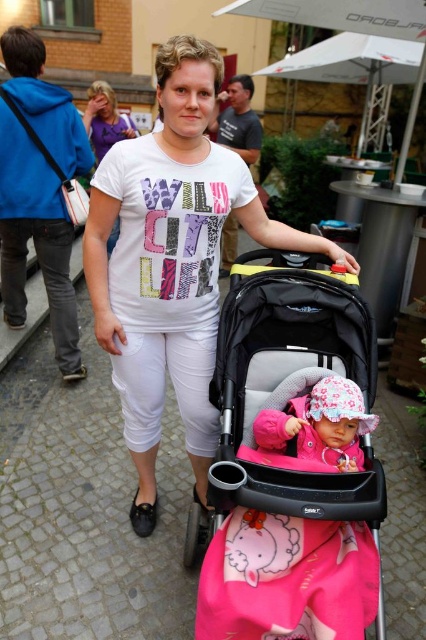
Does point (129, 624) lie in front of point (195, 259)?

Yes, point (129, 624) is closer to viewer.

Who is shorter, cobblestone pavement at center or white printed t-shirt at center?

white printed t-shirt at center

Where is `cobblestone pavement at center`? The image size is (426, 640). cobblestone pavement at center is located at coordinates (81, 529).

Between brushed metal bag at left and dark gray t-shirt at upper center, which one appears on the right side from the viewer's perspective?

dark gray t-shirt at upper center is more to the right.

In the scene shown: Who is lower down, brushed metal bag at left or dark gray t-shirt at upper center?

brushed metal bag at left is below.

Where is `brushed metal bag at left`? The height and width of the screenshot is (640, 426). brushed metal bag at left is located at coordinates (36, 240).

The height and width of the screenshot is (640, 426). What are the coordinates of `brushed metal bag at left` in the screenshot? It's located at (36, 240).

The width and height of the screenshot is (426, 640). What do you see at coordinates (290, 465) in the screenshot? I see `black plastic baby carriage at center` at bounding box center [290, 465].

I want to click on black plastic baby carriage at center, so click(290, 465).

Locate an element on the screen. black plastic baby carriage at center is located at coordinates (290, 465).